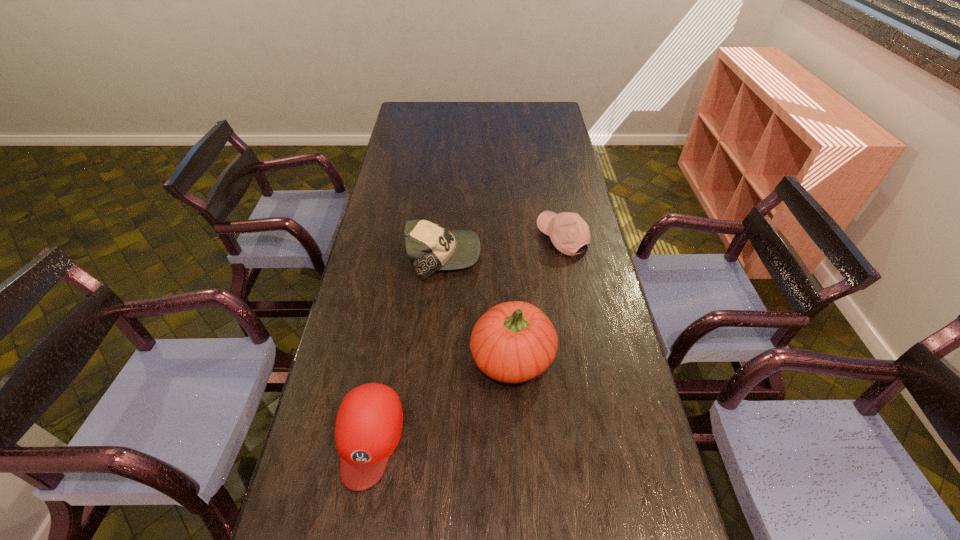
Locate an element on the screen. The height and width of the screenshot is (540, 960). vacant space that satisfies the following two spatial constraints: 1. on the front-facing side of the rightmost baseball cap; 2. on the front-facing side of the nearest baseball cap is located at coordinates (602, 437).